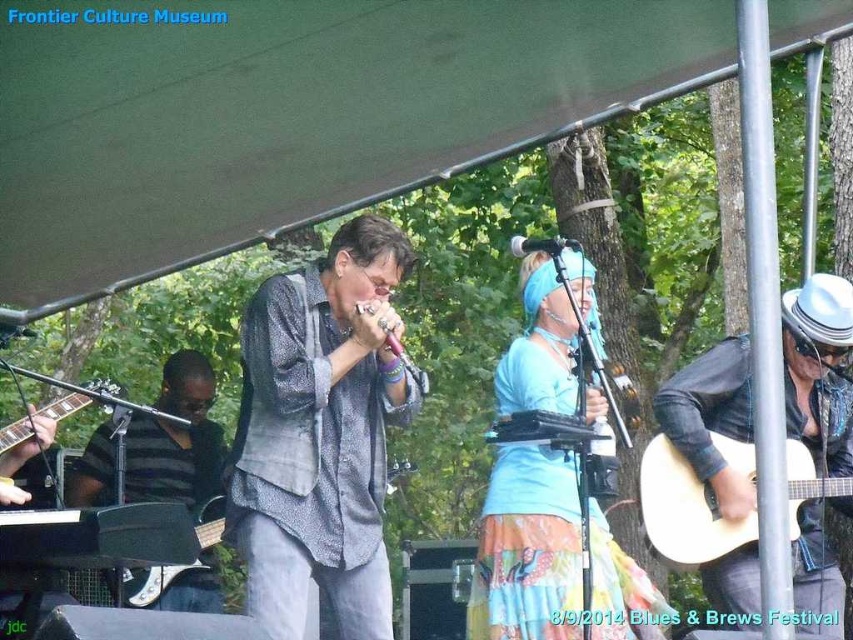
Which is below, textured gray shirt at center or black matte electric guitar at lower left?

black matte electric guitar at lower left

Does textured gray shirt at center have a smaller size compared to black matte electric guitar at lower left?

No, textured gray shirt at center is not smaller than black matte electric guitar at lower left.

Identify the location of textured gray shirt at center. (321, 433).

Which is below, blue fabric headband at center or black matte electric guitar at lower left?

black matte electric guitar at lower left is below.

Does point (628, 602) come behind point (146, 579)?

No, it is not.

Find the location of a particular element. The image size is (853, 640). blue fabric headband at center is located at coordinates (527, 548).

Does point (134, 438) come behind point (672, 460)?

Yes, it is.

Is black matte guitar at left below acoustic wood guitar at right?

Incorrect, black matte guitar at left is not positioned below acoustic wood guitar at right.

Find the location of a particular element. This screenshot has height=640, width=853. black matte guitar at left is located at coordinates (177, 438).

I want to click on black matte guitar at left, so click(x=177, y=438).